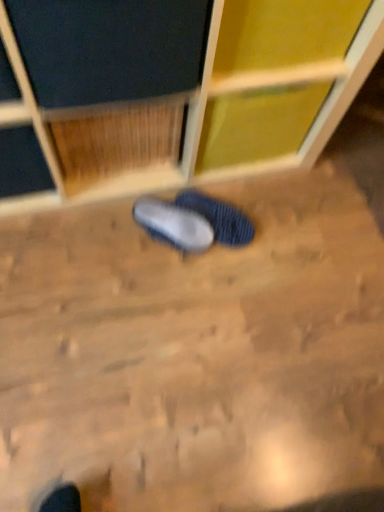
Question: Based on their sizes in the image, would you say blue knitted slipper at center, which appears as the second footwear when viewed from the left, is bigger or smaller than blue fabric slipper at center, which is the 2th footwear from right to left?

Choices:
 (A) small
 (B) big

Answer: (B)

Question: Is blue knitted slipper at center, which appears as the second footwear when viewed from the left, inside the boundaries of blue fabric slipper at center, the first footwear viewed from the left, or outside?

Choices:
 (A) outside
 (B) inside

Answer: (A)

Question: Considering the positions of point (203, 206) and point (178, 245), is point (203, 206) closer or farther from the camera than point (178, 245)?

Choices:
 (A) farther
 (B) closer

Answer: (A)

Question: Is blue fabric slipper at center, the first footwear viewed from the left, wider or thinner than blue knitted slipper at center, which appears as the second footwear when viewed from the left?

Choices:
 (A) wide
 (B) thin

Answer: (B)

Question: From the image's perspective, is blue fabric slipper at center, the first footwear viewed from the left, positioned above or below blue knitted slipper at center, which appears as the second footwear when viewed from the left?

Choices:
 (A) above
 (B) below

Answer: (B)

Question: Is blue fabric slipper at center, the first footwear viewed from the left, to the left or to the right of blue knitted slipper at center, which is the 1th footwear from right to left, in the image?

Choices:
 (A) left
 (B) right

Answer: (A)

Question: From their relative heights in the image, would you say blue fabric slipper at center, the first footwear viewed from the left, is taller or shorter than blue knitted slipper at center, which appears as the second footwear when viewed from the left?

Choices:
 (A) short
 (B) tall

Answer: (A)